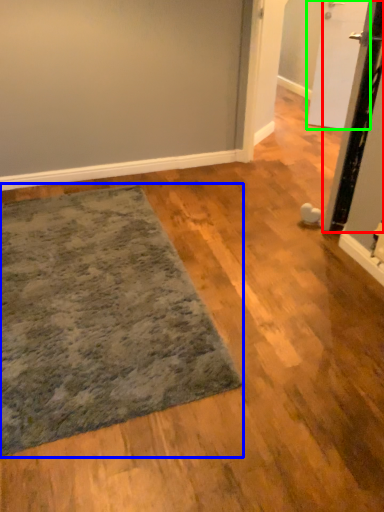
Question: Which object is the closest to the door (highlighted by a red box)? Choose among these: mat (highlighted by a blue box) or door (highlighted by a green box).

Choices:
 (A) mat
 (B) door

Answer: (A)